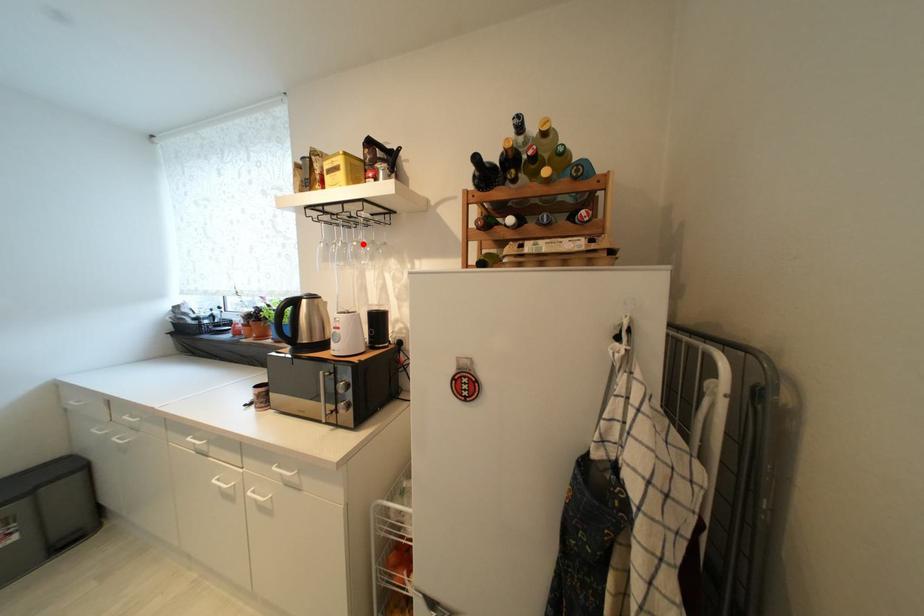
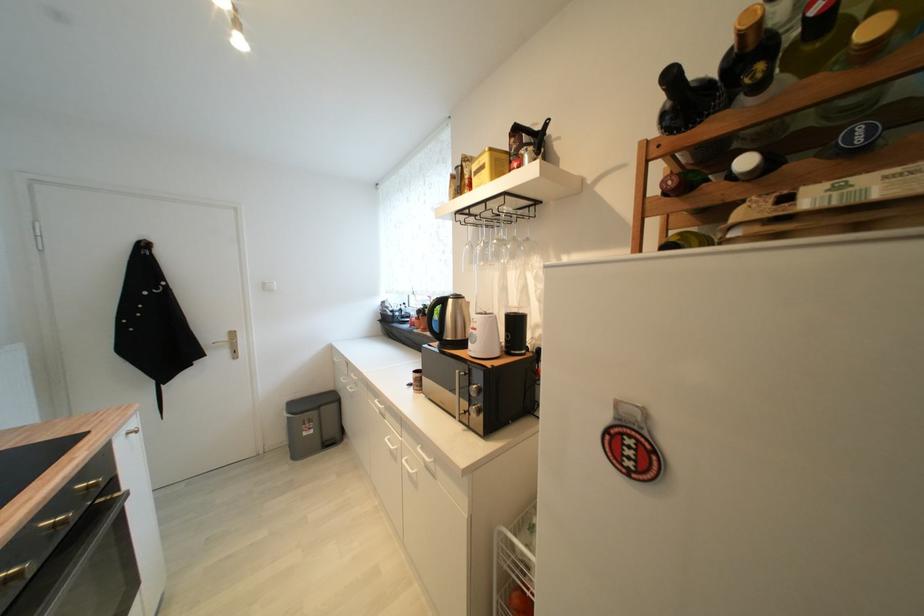
Find the pixel in the second image that matches the highlighted location in the first image.

(504, 241)